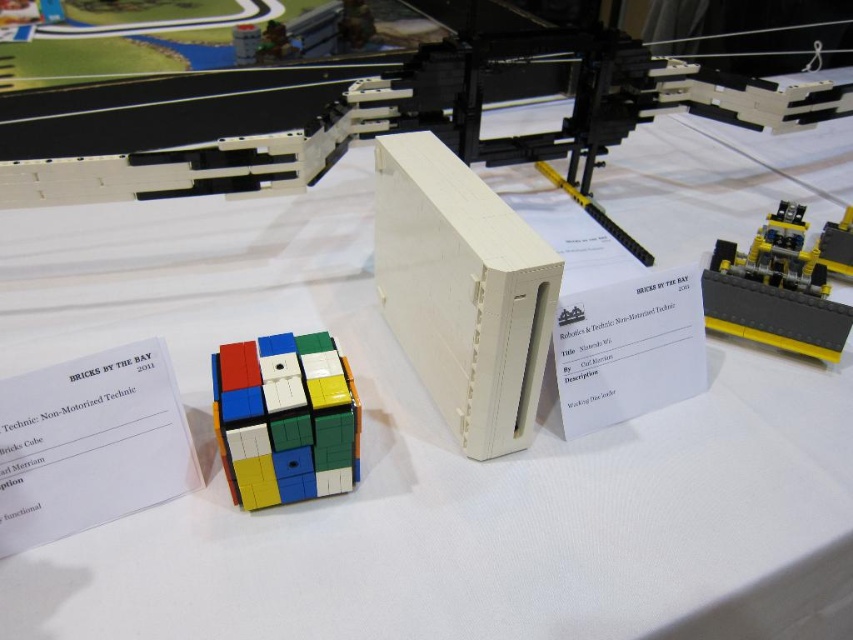
Does multicolored plastic rubik's cube at center appear on the right side of yellow plastic motor at upper right?

No, multicolored plastic rubik's cube at center is not to the right of yellow plastic motor at upper right.

This screenshot has width=853, height=640. What do you see at coordinates (285, 419) in the screenshot?
I see `multicolored plastic rubik's cube at center` at bounding box center [285, 419].

The height and width of the screenshot is (640, 853). I want to click on multicolored plastic rubik's cube at center, so click(285, 419).

Is point (469, 419) closer to viewer compared to point (714, 284)?

Yes, it is in front of point (714, 284).

Can you confirm if white matte rectangular block at center is smaller than yellow plastic motor at upper right?

Actually, white matte rectangular block at center might be larger than yellow plastic motor at upper right.

Locate an element on the screen. white matte rectangular block at center is located at coordinates (462, 291).

Locate an element on the screen. The image size is (853, 640). white matte rectangular block at center is located at coordinates (462, 291).

Between point (515, 339) and point (213, 416), which one is positioned behind?

The point (213, 416) is behind.

Which is in front, point (498, 298) or point (291, 483)?

Point (498, 298) is in front.

Where is `white matte rectangular block at center`? This screenshot has width=853, height=640. white matte rectangular block at center is located at coordinates (462, 291).